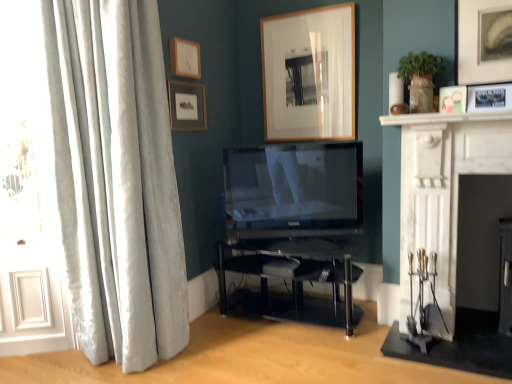
Question: Considering the positions of white marble fireplace at upper right and wooden picture frame at upper center, which ranks as the third picture frame in left-to-right order, in the image, is white marble fireplace at upper right wider or thinner than wooden picture frame at upper center, which ranks as the third picture frame in left-to-right order,?

Choices:
 (A) wide
 (B) thin

Answer: (A)

Question: From the image's perspective, is white marble fireplace at upper right above or below wooden picture frame at upper center, which appears as the 3th picture frame when viewed from the right?

Choices:
 (A) above
 (B) below

Answer: (B)

Question: Estimate the real-world distances between objects in this image. Which object is closer to the silky white curtains at left?

Choices:
 (A) matte wooden picture frame at upper left, arranged as the 5th picture frame when viewed from the right
 (B) transparent glass tv stand at center
 (C) matte wood picture frame at upper center, the 2th picture frame viewed from the left
 (D) matte white picture frame at upper right, which ranks as the 5th picture frame in left-to-right order
 (E) white marble fireplace at upper right

Answer: (A)

Question: Estimate the real-world distances between objects in this image. Which object is farther from the matte black tv at center?

Choices:
 (A) matte wood picture frame at upper center, the 2th picture frame viewed from the left
 (B) wooden picture frame at upper center, which appears as the 3th picture frame when viewed from the right
 (C) white marble fireplace at right
 (D) matte white picture frame at upper right, which ranks as the 1th picture frame in right-to-left order
 (E) silky white curtains at left

Answer: (D)